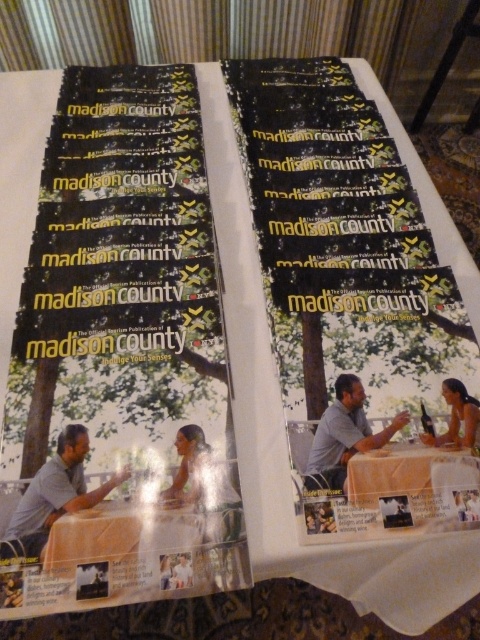
Question: Which of the following is the closest to the observer?

Choices:
 (A) (396, 499)
 (B) (188, 584)
 (C) (210, 534)
 (D) (317, 484)

Answer: (B)

Question: In this image, where is gray fabric tablecloth at center located relative to matte black magazine at center?

Choices:
 (A) above
 (B) below

Answer: (B)

Question: Which object is farther from the camera taking this photo?

Choices:
 (A) matte silver hair at center
 (B) matte black magazine at center

Answer: (B)

Question: Is gray fabric tablecloth at center to the left of smooth skin person at center from the viewer's perspective?

Choices:
 (A) no
 (B) yes

Answer: (A)

Question: Can you confirm if matte gray shirt at center is positioned to the left of smooth skin person at center?

Choices:
 (A) no
 (B) yes

Answer: (B)

Question: Which point is farther to the camera?

Choices:
 (A) (179, 563)
 (B) (404, 477)
 (C) (442, 444)

Answer: (C)